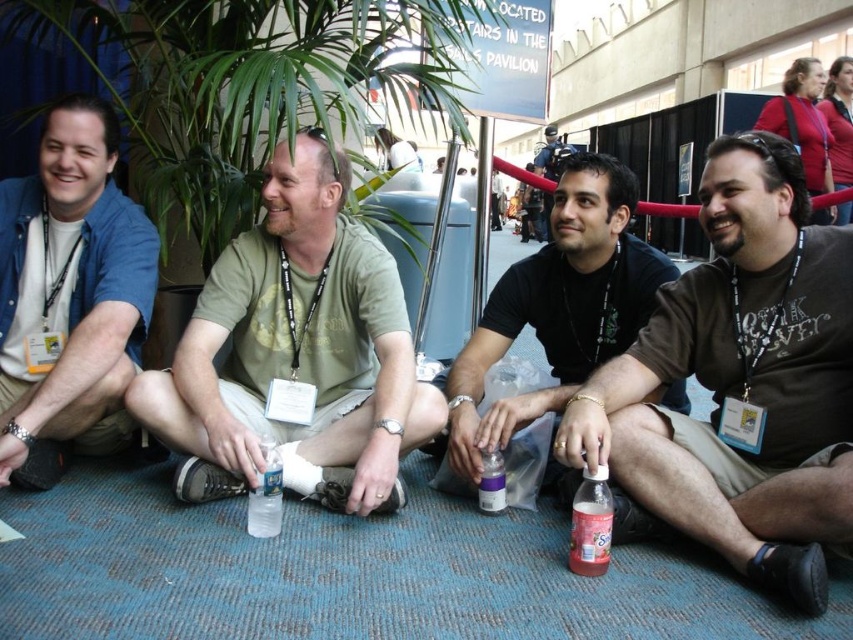
Which is behind, point (279, 488) or point (486, 499)?

The point (486, 499) is more distant.

Does clear plastic bottle at center have a lesser height compared to purple matte bottle at center?

No.

Is point (265, 470) more distant than point (495, 512)?

No, (265, 470) is in front of (495, 512).

Where is `clear plastic bottle at center`? clear plastic bottle at center is located at coordinates (265, 496).

Which of these two, black matte shirt at center or matte black t-shirt at center, stands taller?

matte black t-shirt at center is taller.

Who is shorter, black matte shirt at center or matte black t-shirt at center?

With less height is black matte shirt at center.

Does point (607, 209) come closer to viewer compared to point (844, 211)?

That is True.

Find the location of `black matte shirt at center`. black matte shirt at center is located at coordinates (558, 307).

Who is positioned more to the right, matte blue shirt at left or black matte shirt at center?

From the viewer's perspective, black matte shirt at center appears more on the right side.

Between point (93, 381) and point (625, 209), which one is positioned behind?

The point (625, 209) is more distant.

This screenshot has width=853, height=640. Identify the location of matte blue shirt at left. (71, 288).